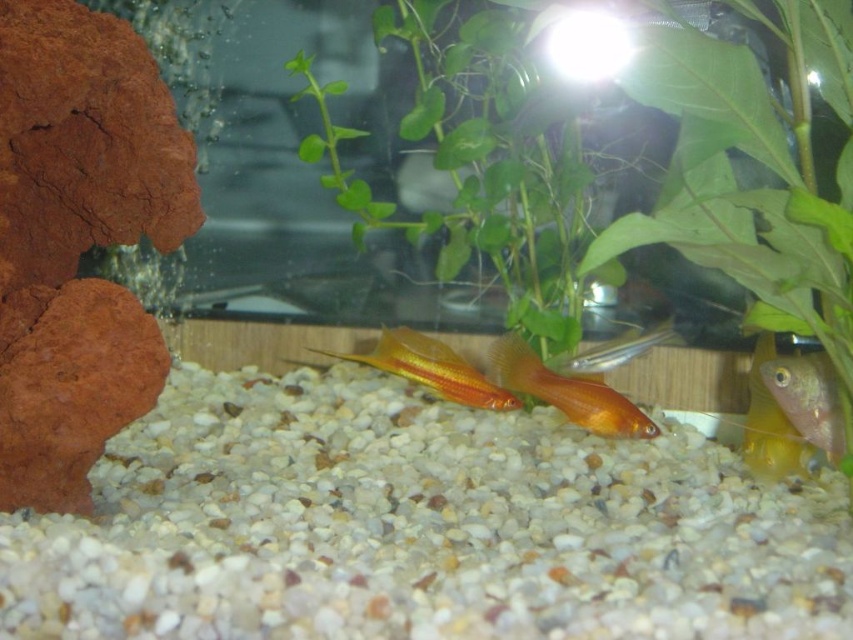
You are a new fish in the aquarium and want to hide behind an object. You see the white pebbles at center and the shiny gold fish at center. Which object can you hide behind?

The white pebbles at center is much taller than the shiny gold fish at center, so you can hide behind the white pebbles at center.

You are an aquarist observing the aquarium. You notice the translucent yellow fish at lower right and the shiny gold fish at center. Which fish has a greater height?

The translucent yellow fish at lower right is much taller than the shiny gold fish at center.

You are an aquatic plant installer working in the aquarium. You need to place a new decoration between the green leafy plant at center and the translucent yellow fish at lower right. Based on their positions, which object should the decoration be closer to?

The decoration should be placed closer to the translucent yellow fish at lower right because the green leafy plant at center is further away from the viewer, meaning the translucent yellow fish at lower right is nearer in the aquarium space.